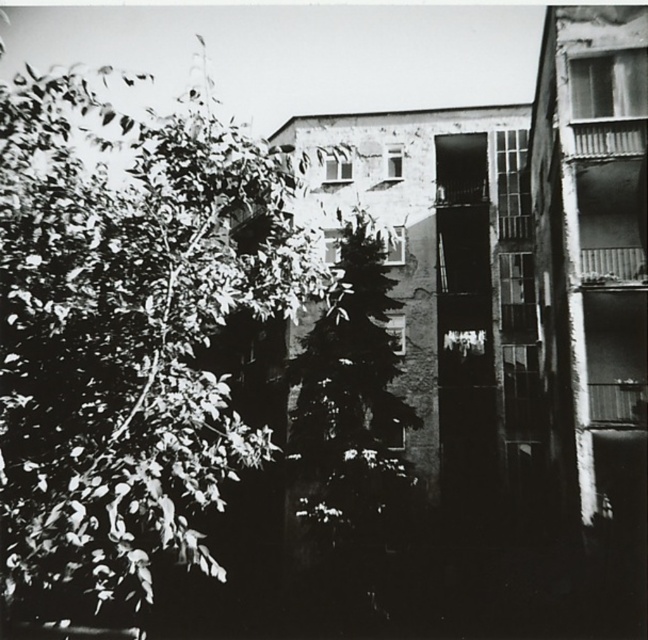
Question: Which point is closer to the camera taking this photo?

Choices:
 (A) (194, 314)
 (B) (371, 506)

Answer: (A)

Question: Which object is closer to the camera taking this photo?

Choices:
 (A) dark green textured tree at center
 (B) green leafy tree at left

Answer: (B)

Question: Which object is farther from the camera taking this photo?

Choices:
 (A) dark green textured tree at center
 (B) green leafy tree at left

Answer: (A)

Question: Does green leafy tree at left have a smaller size compared to dark green textured tree at center?

Choices:
 (A) no
 (B) yes

Answer: (A)

Question: Can you confirm if green leafy tree at left is bigger than dark green textured tree at center?

Choices:
 (A) yes
 (B) no

Answer: (A)

Question: Observing the image, what is the correct spatial positioning of green leafy tree at left in reference to dark green textured tree at center?

Choices:
 (A) left
 (B) right

Answer: (A)